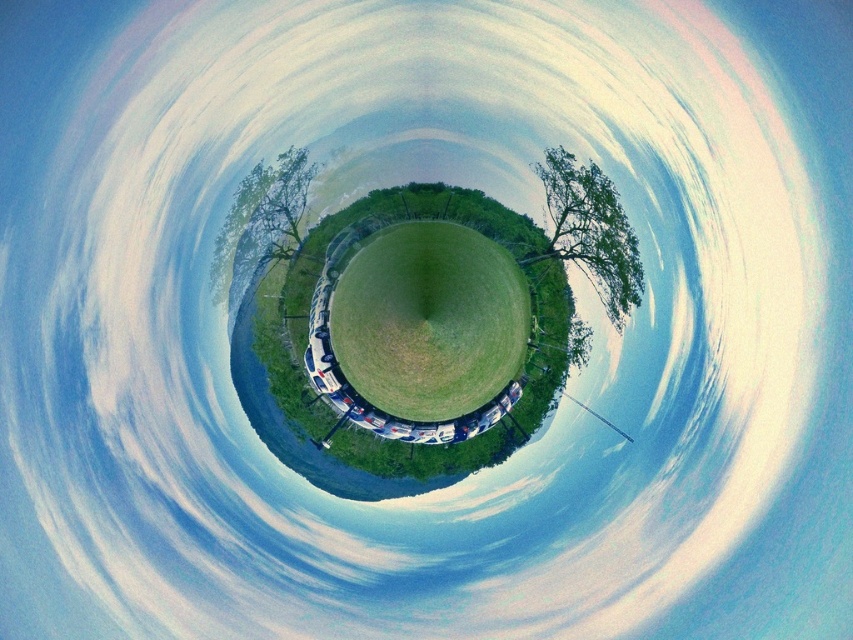
Does green grassy field at center appear over green leafy tree at center?

Incorrect, green grassy field at center is not positioned above green leafy tree at center.

Can you confirm if green grassy field at center is positioned below green leafy tree at center?

→ Yes.

Is point (395, 406) farther from camera compared to point (259, 172)?

Yes, point (395, 406) is farther from viewer.

At what (x,y) coordinates should I click in order to perform the action: click on green grassy field at center. Please return your answer as a coordinate pair (x, y). Looking at the image, I should click on (x=428, y=321).

Does green grassy field at center have a lesser width compared to green leafy tree at upper right?

No, green grassy field at center is not thinner than green leafy tree at upper right.

Does green grassy field at center have a smaller size compared to green leafy tree at upper right?

No, green grassy field at center is not smaller than green leafy tree at upper right.

Does point (368, 378) come in front of point (561, 147)?

No.

What are the coordinates of `green grassy field at center` in the screenshot? It's located at (428, 321).

Find the location of a particular element. green leafy tree at upper right is located at coordinates (590, 230).

Is green leafy tree at upper right thinner than green leafy tree at center?

No, green leafy tree at upper right is not thinner than green leafy tree at center.

Locate an element on the screen. This screenshot has height=640, width=853. green leafy tree at upper right is located at coordinates (590, 230).